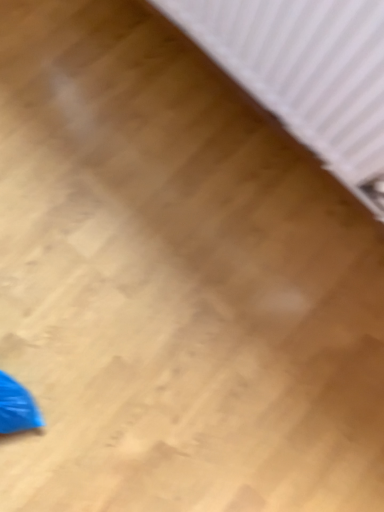
Where is `vacant space to the right of white textured radiator at upper right`? The width and height of the screenshot is (384, 512). vacant space to the right of white textured radiator at upper right is located at coordinates (321, 293).